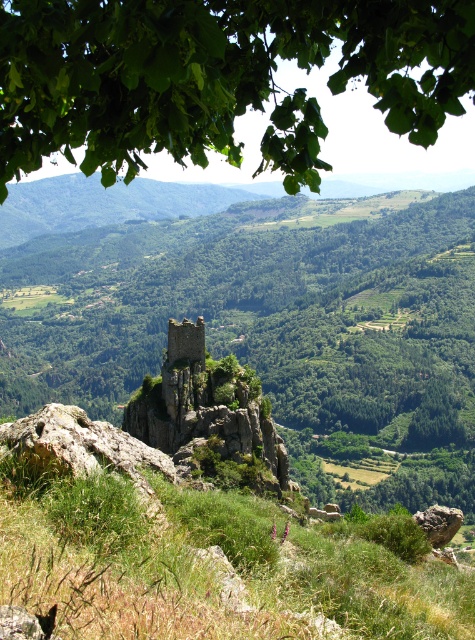
Question: Is green leafy tree at upper center smaller than rustic stone tower at center?

Choices:
 (A) yes
 (B) no

Answer: (B)

Question: Among these objects, which one is farthest from the camera?

Choices:
 (A) rustic stone tower at center
 (B) green leafy tree at center
 (C) green grassy at center

Answer: (B)

Question: From the image, what is the correct spatial relationship of green leafy tree at upper center in relation to rustic stone tower at center?

Choices:
 (A) left
 (B) right

Answer: (B)

Question: Which object is the farthest from the green grassy at center?

Choices:
 (A) green leafy tree at upper center
 (B) rustic stone tower at center

Answer: (A)

Question: Does green leafy tree at upper center appear on the left side of rustic stone tower at center?

Choices:
 (A) yes
 (B) no

Answer: (B)

Question: Which point is closer to the camera?

Choices:
 (A) rustic stone tower at center
 (B) green leafy tree at upper center
 (C) green leafy tree at center

Answer: (B)